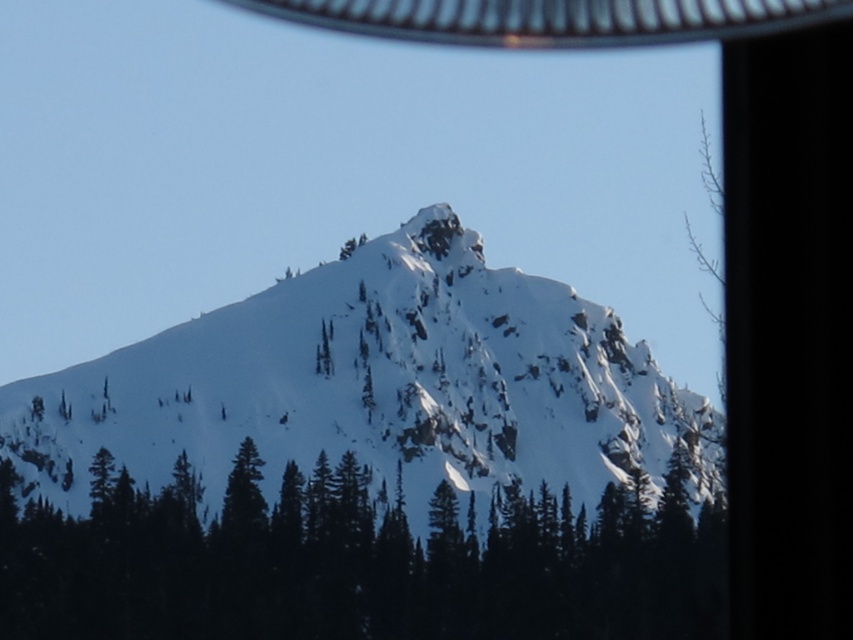
Question: Which point is closer to the camera taking this photo?

Choices:
 (A) (492, 625)
 (B) (465, 486)

Answer: (A)

Question: Is white snow-covered mountain at center smaller than green matte tree at center?

Choices:
 (A) yes
 (B) no

Answer: (B)

Question: Can you confirm if white snow-covered mountain at center is wider than green matte tree at center?

Choices:
 (A) yes
 (B) no

Answer: (A)

Question: Which object is closer to the camera taking this photo?

Choices:
 (A) green matte tree at center
 (B) white snow-covered mountain at center

Answer: (A)

Question: Is white snow-covered mountain at center to the left of green matte tree at center from the viewer's perspective?

Choices:
 (A) yes
 (B) no

Answer: (A)